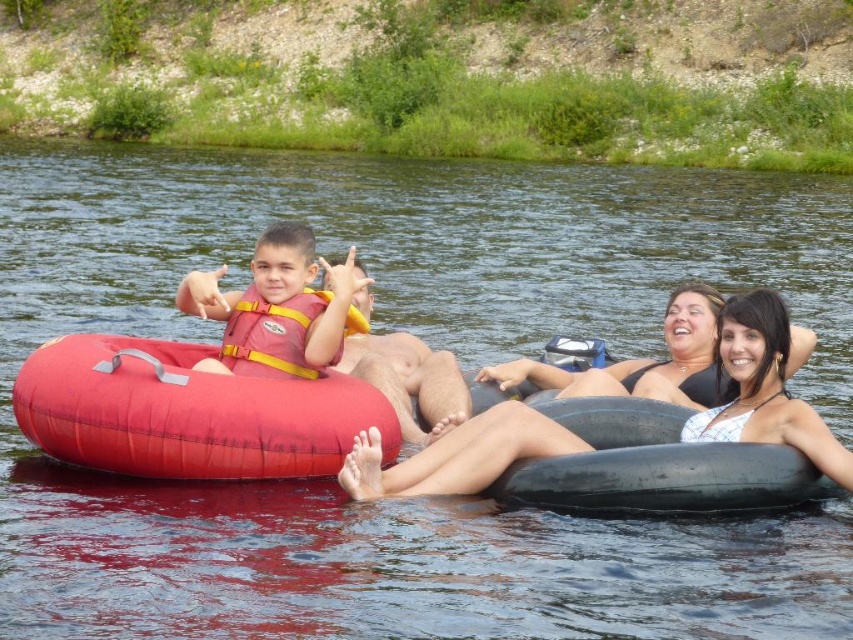
You are navigating a small boat on the river and need to avoid obstacles. There is a matte pink life vest at left located at point (276, 308). Can you safely pass through this point without hitting the life vest?

The matte pink life vest at left is located exactly at point (276, 308), so you cannot safely pass through this point without hitting the life vest.